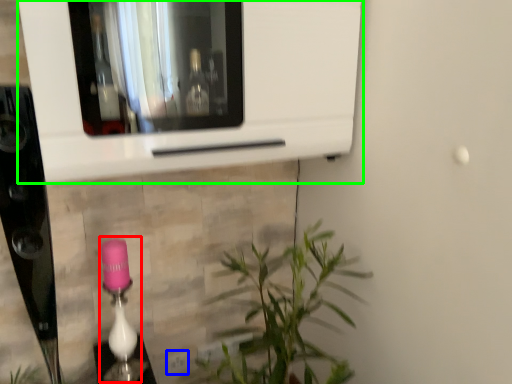
Question: Which object is the closest to the lamp (highlighted by a red box)? Choose among these: electric outlet (highlighted by a blue box) or microwave (highlighted by a green box).

Choices:
 (A) electric outlet
 (B) microwave

Answer: (A)